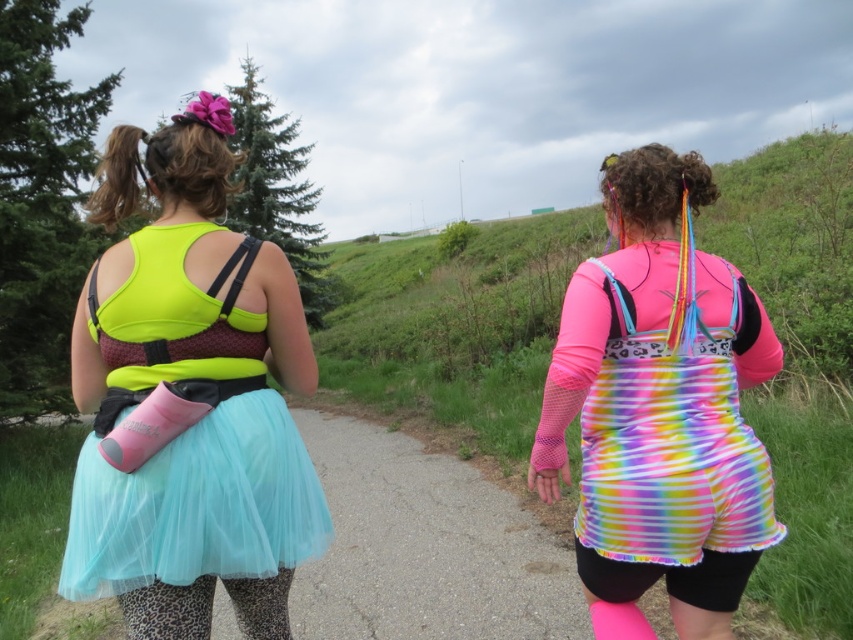
Question: From the image, what is the correct spatial relationship of neon green fabric tank top at upper left in relation to light blue tulle skirt at center?

Choices:
 (A) left
 (B) right

Answer: (A)

Question: Can you confirm if neon green fabric tank top at upper left is smaller than rainbow tie-dye shorts at center?

Choices:
 (A) yes
 (B) no

Answer: (B)

Question: Based on their relative distances, which object is nearer to the leopard print leggings at lower center?

Choices:
 (A) rainbow tie-dye shorts at center
 (B) light blue tulle skirt at center
 (C) neon green fabric tank top at upper left

Answer: (B)

Question: Is neon green fabric tank top at upper left smaller than rainbow tie-dye shorts at center?

Choices:
 (A) no
 (B) yes

Answer: (A)

Question: Among these points, which one is nearest to the camera?

Choices:
 (A) pos(173,566)
 (B) pos(218,145)
 (C) pos(619,538)
 (D) pos(165,630)

Answer: (A)

Question: Which point is farther to the camera?

Choices:
 (A) leopard print leggings at lower center
 (B) rainbow tie-dye shorts at center

Answer: (B)